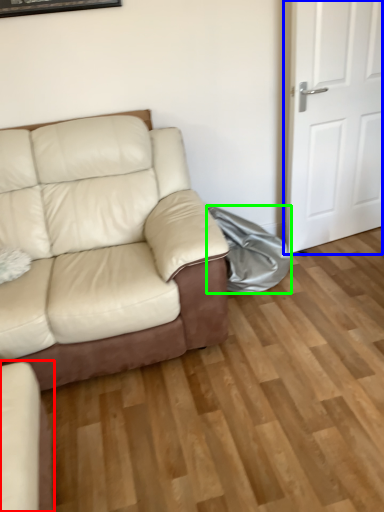
Question: Estimate the real-world distances between objects in this image. Which object is closer to studio couch (highlighted by a red box), door (highlighted by a blue box) or material (highlighted by a green box)?

Choices:
 (A) door
 (B) material

Answer: (B)